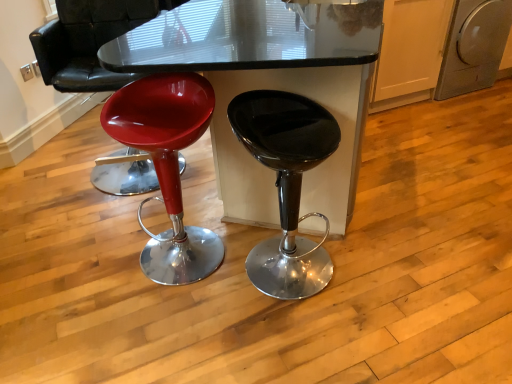
At what (x,y) coordinates should I click in order to perform the action: click on vacant space behind glossy plastic stool at left, which is the 2th stool in right-to-left order. Please return your answer as a coordinate pair (x, y). The height and width of the screenshot is (384, 512). Looking at the image, I should click on (183, 216).